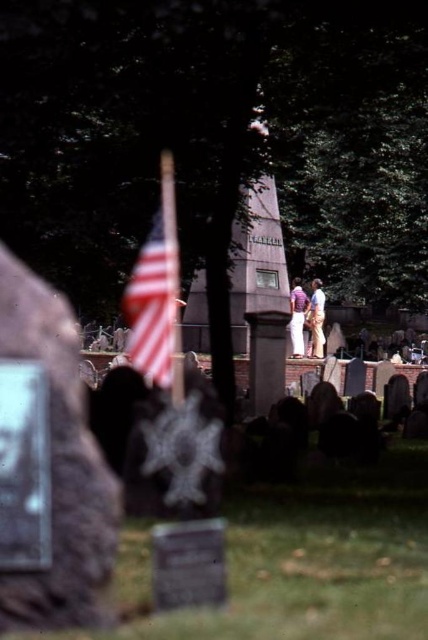
Question: Is purple cotton shirt at center bigger than light purple shirt at center?

Choices:
 (A) yes
 (B) no

Answer: (A)

Question: Which point is farther from the camera taking this photo?

Choices:
 (A) (312, 348)
 (B) (157, 323)

Answer: (A)

Question: Among these points, which one is farthest from the camera?

Choices:
 (A) (124, 289)
 (B) (293, 285)
 (C) (309, 323)

Answer: (B)

Question: Which object appears closest to the camera in this image?

Choices:
 (A) light purple shirt at center
 (B) purple cotton shirt at center
 (C) american flag at center

Answer: (C)

Question: Is purple cotton shirt at center closer to camera compared to light purple shirt at center?

Choices:
 (A) yes
 (B) no

Answer: (A)

Question: Is purple cotton shirt at center positioned before light purple shirt at center?

Choices:
 (A) no
 (B) yes

Answer: (B)